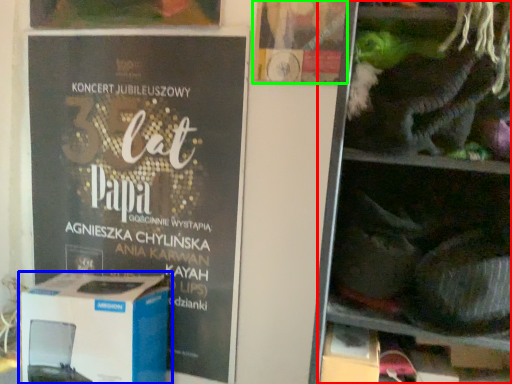
Question: Which object is the closest to the shelf (highlighted by a red box)? Choose among these: box (highlighted by a blue box) or flyer (highlighted by a green box).

Choices:
 (A) box
 (B) flyer

Answer: (B)